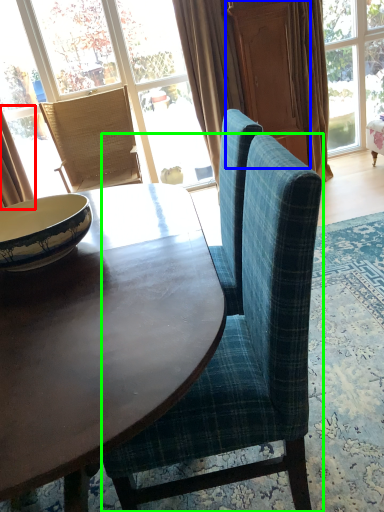
Question: Estimate the real-world distances between objects in this image. Which object is closer to curtain (highlighted by a red box), screen door (highlighted by a blue box) or chair (highlighted by a green box)?

Choices:
 (A) screen door
 (B) chair

Answer: (A)